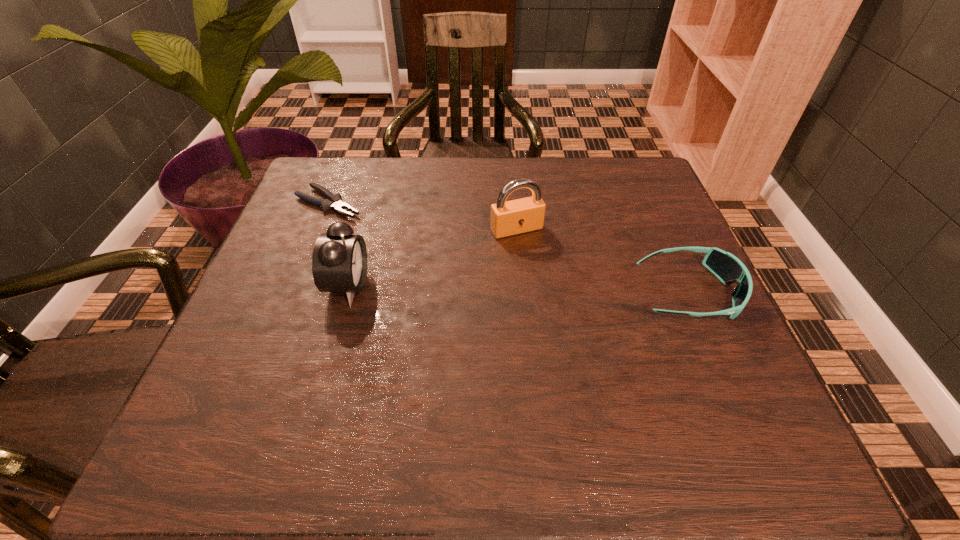
The image size is (960, 540). I want to click on free space located at the gripping part of the shortest object, so click(x=463, y=268).

Where is `blank space located at the gripping part of the shortest object`? blank space located at the gripping part of the shortest object is located at coordinates click(x=434, y=253).

Where is `object located in the far edge section of the desktop`? object located in the far edge section of the desktop is located at coordinates (335, 202).

Locate an element on the screen. alarm clock that is positioned at the left edge is located at coordinates (339, 260).

Image resolution: width=960 pixels, height=540 pixels. I want to click on pliers at the left edge, so click(x=335, y=202).

Locate an element on the screen. object present at the right edge is located at coordinates (725, 266).

At what (x,y) coordinates should I click in order to perform the action: click on object present at the far left corner. Please return your answer as a coordinate pair (x, y). Image resolution: width=960 pixels, height=540 pixels. Looking at the image, I should click on (335, 202).

In the image, there is a desktop. Where is `vacant space at the far edge`? The image size is (960, 540). vacant space at the far edge is located at coordinates (542, 166).

At what (x,y) coordinates should I click in order to perform the action: click on free spot at the near edge of the desktop. Please return your answer as a coordinate pair (x, y). The height and width of the screenshot is (540, 960). Looking at the image, I should click on (546, 379).

This screenshot has width=960, height=540. I want to click on vacant region at the left edge of the desktop, so click(235, 349).